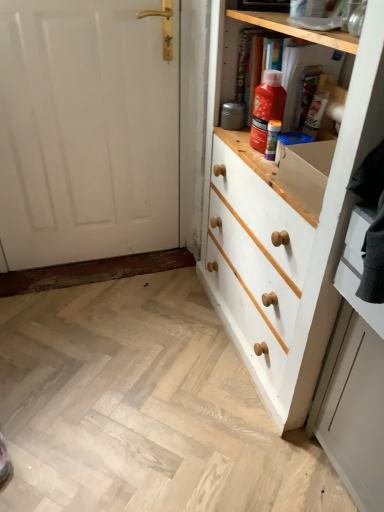
Question: Can you confirm if white painted wood chest of drawers at right is bigger than white painted wood drawer at right?

Choices:
 (A) yes
 (B) no

Answer: (A)

Question: Can you confirm if white painted wood chest of drawers at right is thinner than white painted wood drawer at right?

Choices:
 (A) yes
 (B) no

Answer: (B)

Question: Can you confirm if white painted wood chest of drawers at right is taller than white painted wood drawer at right?

Choices:
 (A) no
 (B) yes

Answer: (B)

Question: Is white painted wood chest of drawers at right outside white painted wood drawer at right?

Choices:
 (A) no
 (B) yes

Answer: (B)

Question: From a real-world perspective, does white painted wood chest of drawers at right sit lower than white painted wood drawer at right?

Choices:
 (A) yes
 (B) no

Answer: (A)

Question: Is white painted wood chest of drawers at right spatially inside purple plastic tube at upper center, or outside of it?

Choices:
 (A) inside
 (B) outside

Answer: (B)

Question: Considering the positions of white painted wood chest of drawers at right and purple plastic tube at upper center in the image, is white painted wood chest of drawers at right wider or thinner than purple plastic tube at upper center?

Choices:
 (A) thin
 (B) wide

Answer: (B)

Question: Based on their sizes in the image, would you say white painted wood chest of drawers at right is bigger or smaller than purple plastic tube at upper center?

Choices:
 (A) big
 (B) small

Answer: (A)

Question: Is white painted wood chest of drawers at right taller or shorter than purple plastic tube at upper center?

Choices:
 (A) short
 (B) tall

Answer: (B)

Question: Would you say purple plastic tube at upper center is inside or outside white painted wood drawer at right?

Choices:
 (A) inside
 (B) outside

Answer: (B)

Question: Based on their positions, is purple plastic tube at upper center located to the left or right of white painted wood drawer at right?

Choices:
 (A) left
 (B) right

Answer: (A)

Question: In terms of height, does purple plastic tube at upper center look taller or shorter compared to white painted wood drawer at right?

Choices:
 (A) tall
 (B) short

Answer: (B)

Question: From a real-world perspective, relative to white painted wood drawer at right, is purple plastic tube at upper center vertically above or below?

Choices:
 (A) above
 (B) below

Answer: (A)

Question: From the image's perspective, is white painted wood drawer at right positioned above or below purple plastic tube at upper center?

Choices:
 (A) below
 (B) above

Answer: (A)

Question: In terms of width, does white painted wood drawer at right look wider or thinner when compared to purple plastic tube at upper center?

Choices:
 (A) thin
 (B) wide

Answer: (B)